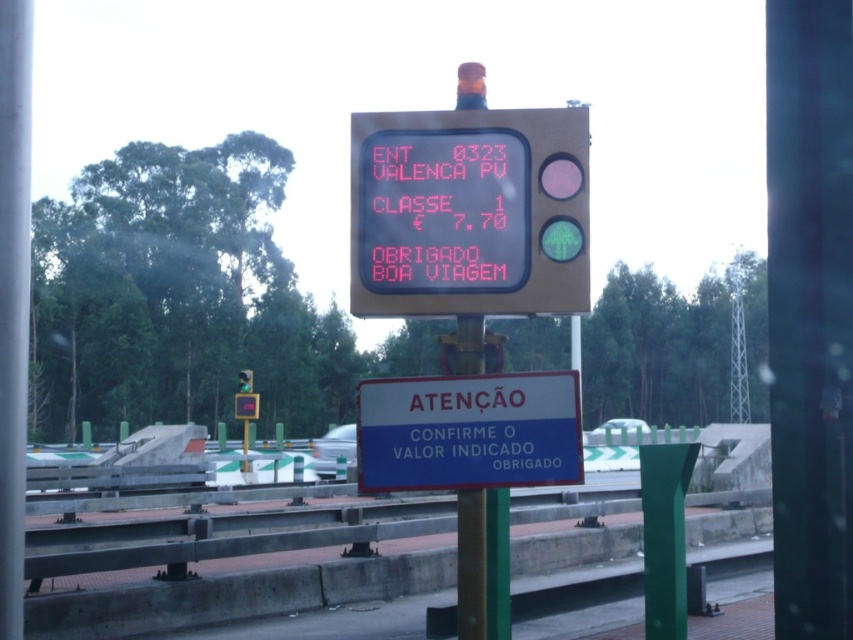
Question: Which point is closer to the camera?

Choices:
 (A) green glass traffic light at upper center
 (B) blue plastic sign at center

Answer: (B)

Question: Which of the following is the closest to the observer?

Choices:
 (A) blue plastic sign at center
 (B) green glass traffic light at upper center

Answer: (A)

Question: Does blue plastic sign at center have a larger size compared to green glass traffic light at upper center?

Choices:
 (A) no
 (B) yes

Answer: (A)

Question: Does blue plastic sign at center come behind green glass traffic light at upper center?

Choices:
 (A) no
 (B) yes

Answer: (A)

Question: Is blue plastic sign at center closer to the viewer compared to green glass traffic light at upper center?

Choices:
 (A) yes
 (B) no

Answer: (A)